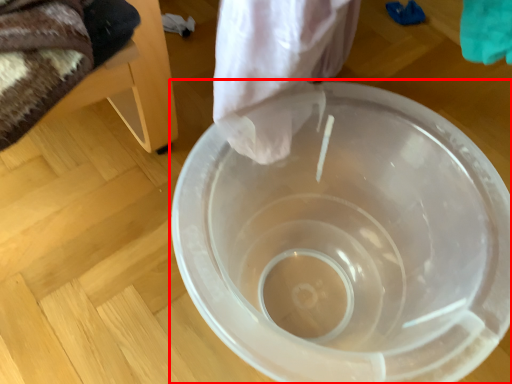
Question: From the image's perspective, considering the relative positions of toilet (annotated by the red box) and furniture in the image provided, where is toilet (annotated by the red box) located with respect to the staircase?

Choices:
 (A) above
 (B) below

Answer: (B)